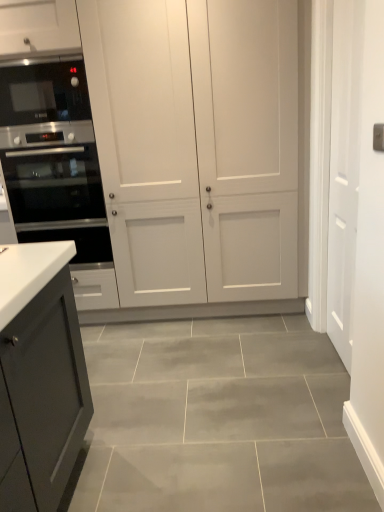
Question: Is black glass microwave at left wider or thinner than white matte door at right?

Choices:
 (A) wide
 (B) thin

Answer: (A)

Question: Relative to white matte door at right, is black glass microwave at left in front or behind?

Choices:
 (A) behind
 (B) front

Answer: (A)

Question: Which object is the farthest from the satin black oven at left?

Choices:
 (A) black glass microwave at left
 (B) white matte door at right
 (C) white matte cabinet at center

Answer: (B)

Question: Which is nearer to the satin black oven at left?

Choices:
 (A) white matte door at right
 (B) white matte cabinet at center
 (C) black glass microwave at left

Answer: (C)